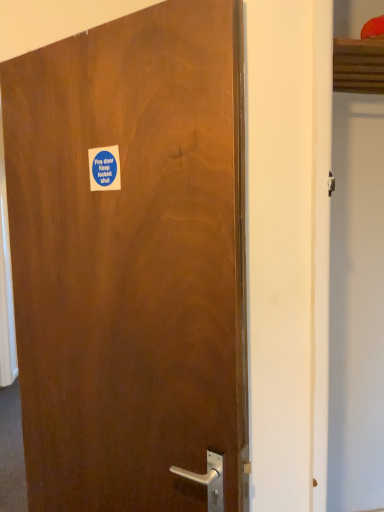
In order to face brown matte door at center, should I rotate leftwards or rightwards?

A 10.812 degree turn to the left will do.

Describe the element at coordinates (130, 259) in the screenshot. The height and width of the screenshot is (512, 384). I see `brown matte door at center` at that location.

Where is `brown matte door at center`? This screenshot has height=512, width=384. brown matte door at center is located at coordinates (130, 259).

Identify the location of blue paper sticker at upper left. The height and width of the screenshot is (512, 384). (104, 168).

Describe the element at coordinates (104, 168) in the screenshot. I see `blue paper sticker at upper left` at that location.

In order to face blue paper sticker at upper left, should I rotate leftwards or rightwards?

A 11.781 degree turn to the left will do.

At what (x,y) coordinates should I click in order to perform the action: click on brown matte door at center. Please return your answer as a coordinate pair (x, y). The width and height of the screenshot is (384, 512). Looking at the image, I should click on pos(130,259).

Considering the positions of objects brown matte door at center and blue paper sticker at upper left in the image provided, who is more to the right, brown matte door at center or blue paper sticker at upper left?

brown matte door at center is more to the right.

Does brown matte door at center come in front of blue paper sticker at upper left?

Yes, brown matte door at center is closer to the viewer.

Is point (115, 100) positioned in front of point (104, 150)?

Yes, point (115, 100) is in front of point (104, 150).

From the image's perspective, which one is positioned lower, brown matte door at center or blue paper sticker at upper left?

brown matte door at center.

From a real-world perspective, is brown matte door at center located higher than blue paper sticker at upper left?

No, from a real-world perspective, brown matte door at center is not on top of blue paper sticker at upper left.

Considering the sizes of brown matte door at center and blue paper sticker at upper left in the image, is brown matte door at center wider or thinner than blue paper sticker at upper left?

Clearly, brown matte door at center has more width compared to blue paper sticker at upper left.

Can you confirm if brown matte door at center is shorter than blue paper sticker at upper left?

No, brown matte door at center is not shorter than blue paper sticker at upper left.

Considering the relative sizes of brown matte door at center and blue paper sticker at upper left in the image provided, is brown matte door at center smaller than blue paper sticker at upper left?

Incorrect, brown matte door at center is not smaller in size than blue paper sticker at upper left.

Consider the image. Is brown matte door at center inside the boundaries of blue paper sticker at upper left, or outside?

brown matte door at center is not enclosed by blue paper sticker at upper left.

Is brown matte door at center not near blue paper sticker at upper left?

No, brown matte door at center is in close proximity to blue paper sticker at upper left.

Is brown matte door at center turned away from blue paper sticker at upper left?

Yes, brown matte door at center is positioned with its back facing blue paper sticker at upper left.

Can you tell me how much brown matte door at center and blue paper sticker at upper left differ in facing direction?

brown matte door at center and blue paper sticker at upper left are facing 0.0211 degrees away from each other.

At what (x,y) coordinates should I click in order to perform the action: click on sticker above the brown matte door at center (from the image's perspective). Please return your answer as a coordinate pair (x, y). Looking at the image, I should click on pos(104,168).

Is blue paper sticker at upper left at the left side of brown matte door at center?

Yes, blue paper sticker at upper left is to the left of brown matte door at center.

Is the position of blue paper sticker at upper left more distant than that of brown matte door at center?

Yes, it is.

Considering the positions of point (92, 188) and point (73, 339), is point (92, 188) closer or farther from the camera than point (73, 339)?

Point (92, 188).

From the image's perspective, relative to brown matte door at center, is blue paper sticker at upper left above or below?

Clearly, from the image's perspective, blue paper sticker at upper left is above brown matte door at center.

From a real-world perspective, is blue paper sticker at upper left on top of brown matte door at center?

Indeed, from a real-world perspective, blue paper sticker at upper left stands above brown matte door at center.

Which of these two, blue paper sticker at upper left or brown matte door at center, is thinner?

blue paper sticker at upper left is thinner.

Is blue paper sticker at upper left shorter than brown matte door at center?

Yes.

Considering the sizes of objects blue paper sticker at upper left and brown matte door at center in the image provided, who is bigger, blue paper sticker at upper left or brown matte door at center?

brown matte door at center is bigger.

Would you say blue paper sticker at upper left is inside or outside brown matte door at center?

blue paper sticker at upper left is located inside brown matte door at center.

Is blue paper sticker at upper left in contact with brown matte door at center?

There is a gap between blue paper sticker at upper left and brown matte door at center.

In the scene shown: Is blue paper sticker at upper left facing away from brown matte door at center?

Yes, blue paper sticker at upper left is positioned with its back facing brown matte door at center.

How different are the orientations of blue paper sticker at upper left and brown matte door at center in degrees?

The facing directions of blue paper sticker at upper left and brown matte door at center are 0.0211 degrees apart.

Measure the distance between blue paper sticker at upper left and brown matte door at center.

13.28 inches.

At what (x,y) coordinates should I click in order to perform the action: click on sticker above the brown matte door at center (from a real-world perspective). Please return your answer as a coordinate pair (x, y). This screenshot has height=512, width=384. Looking at the image, I should click on (104, 168).

In the image, there is a brown matte door at center. Where is `sticker above it (from the image's perspective)`? The image size is (384, 512). sticker above it (from the image's perspective) is located at coordinates (104, 168).

The width and height of the screenshot is (384, 512). Identify the location of door on the right of blue paper sticker at upper left. (130, 259).